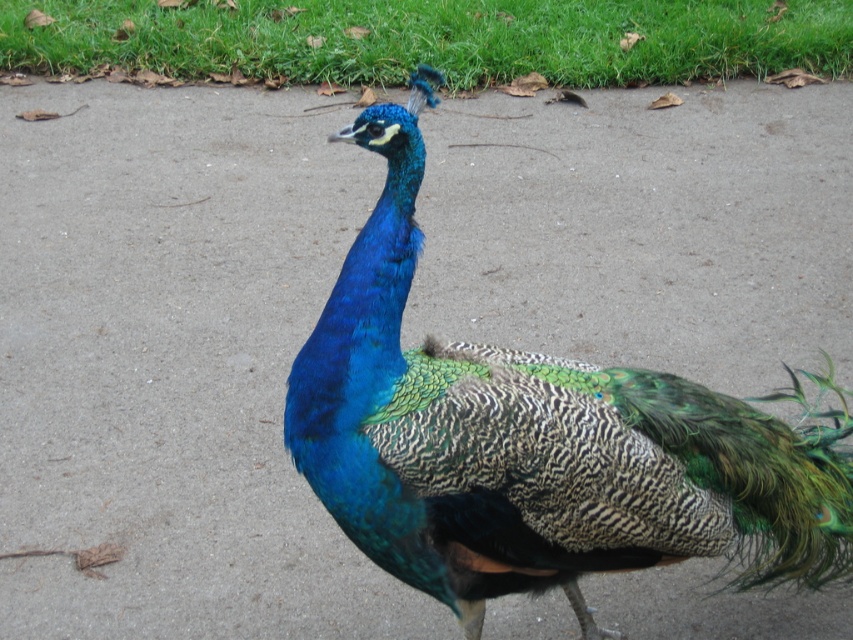
Can you confirm if shiny blue peacock at center is taller than green grass at upper center?

Yes.

You are a GUI agent. You are given a task and a screenshot of the screen. Output one action in this format:
    pyautogui.click(x=<x>, y=<y>)
    Task: Click on the shiny blue peacock at center
    The height and width of the screenshot is (640, 853).
    Given the screenshot: What is the action you would take?
    pyautogui.click(x=535, y=442)

Which is in front, point (643, 396) or point (566, 16)?

Point (643, 396)

Where is `shiny blue peacock at center`? The width and height of the screenshot is (853, 640). shiny blue peacock at center is located at coordinates pyautogui.click(x=535, y=442).